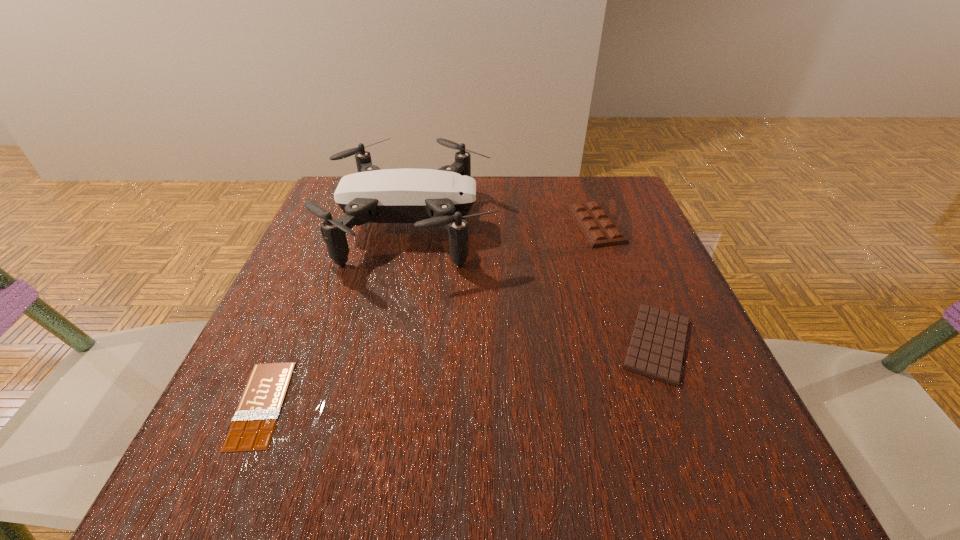
Find the location of a particular element. The height and width of the screenshot is (540, 960). vacant space that's between the drone and the leftmost chocolate bar is located at coordinates (337, 315).

This screenshot has height=540, width=960. Find the location of `vacant space that's between the second tallest chocolate bar and the shortest chocolate bar`. vacant space that's between the second tallest chocolate bar and the shortest chocolate bar is located at coordinates (459, 374).

Locate an element on the screen. The image size is (960, 540). vacant area that lies between the second shortest chocolate bar and the leftmost chocolate bar is located at coordinates (459, 374).

At what (x,y) coordinates should I click in order to perform the action: click on free area in between the second tallest object and the second tallest chocolate bar. Please return your answer as a coordinate pair (x, y). Looking at the image, I should click on (626, 284).

The image size is (960, 540). I want to click on vacant space that is in between the drone and the farthest chocolate bar, so click(504, 225).

This screenshot has height=540, width=960. I want to click on vacant space that's between the second shortest chocolate bar and the leftmost chocolate bar, so click(x=459, y=374).

You are a GUI agent. You are given a task and a screenshot of the screen. Output one action in this format:
    pyautogui.click(x=<x>, y=<y>)
    Task: Click on the object that ranks as the second closest to the second shortest chocolate bar
    This screenshot has width=960, height=540.
    Given the screenshot: What is the action you would take?
    pyautogui.click(x=429, y=198)

Identify which object is the third closest to the tallest object. Please provide its 2D coordinates. Your answer should be formatted as a tuple, i.e. [(x, y)], where the tuple contains the x and y coordinates of a point satisfying the conditions above.

[(656, 350)]

Locate which chocolate bar is the second closest to the tallest object. Please provide its 2D coordinates. Your answer should be formatted as a tuple, i.e. [(x, y)], where the tuple contains the x and y coordinates of a point satisfying the conditions above.

[(252, 428)]

Point out which chocolate bar is positioned as the nearest to the tallest chocolate bar. Please provide its 2D coordinates. Your answer should be formatted as a tuple, i.e. [(x, y)], where the tuple contains the x and y coordinates of a point satisfying the conditions above.

[(656, 350)]